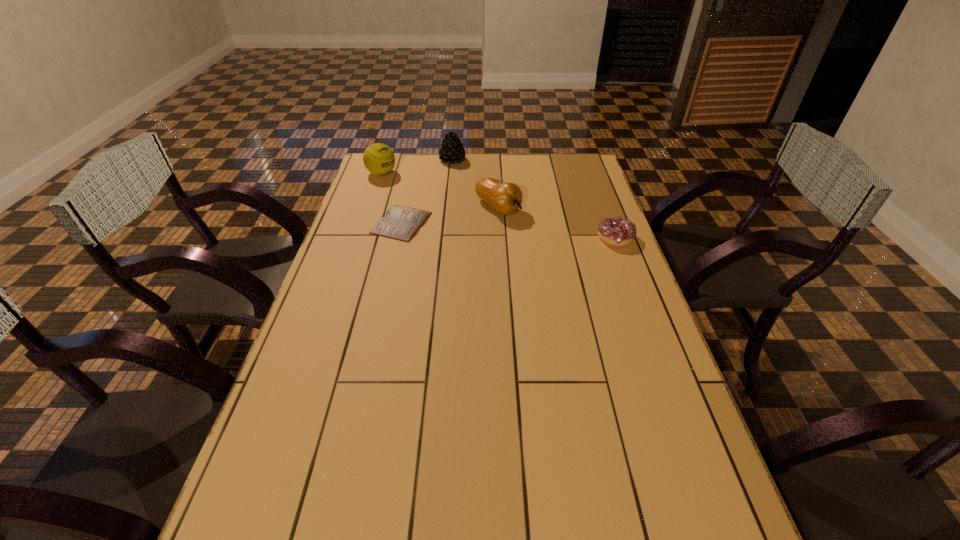
The image size is (960, 540). I want to click on the shortest object, so tap(400, 223).

Where is `doughnut`? doughnut is located at coordinates (615, 231).

You are a GUI agent. You are given a task and a screenshot of the screen. Output one action in this format:
    pyautogui.click(x=<x>, y=<y>)
    Task: Click on the fourth tallest object
    
    Given the screenshot: What is the action you would take?
    pyautogui.click(x=615, y=231)

Find the location of a particular element. pinecone is located at coordinates pyautogui.click(x=451, y=150).

This screenshot has width=960, height=540. Find the location of `gourd`. gourd is located at coordinates (506, 198).

This screenshot has width=960, height=540. What are the coordinates of `softball` in the screenshot? It's located at (378, 158).

The height and width of the screenshot is (540, 960). Identify the location of free region located on the right of the diary. (477, 223).

At what (x,y) coordinates should I click in order to perform the action: click on free space located 0.140m on the left of the doughnut. Please return your answer as a coordinate pair (x, y). Looking at the image, I should click on (554, 238).

Locate an element on the screen. The image size is (960, 540). free region located at the narrow end of the pinecone is located at coordinates (470, 176).

At what (x,y) coordinates should I click in order to perform the action: click on blank space located 0.350m at the narrow end of the pinecone. Please return your answer as a coordinate pair (x, y). The image size is (960, 540). Looking at the image, I should click on (503, 206).